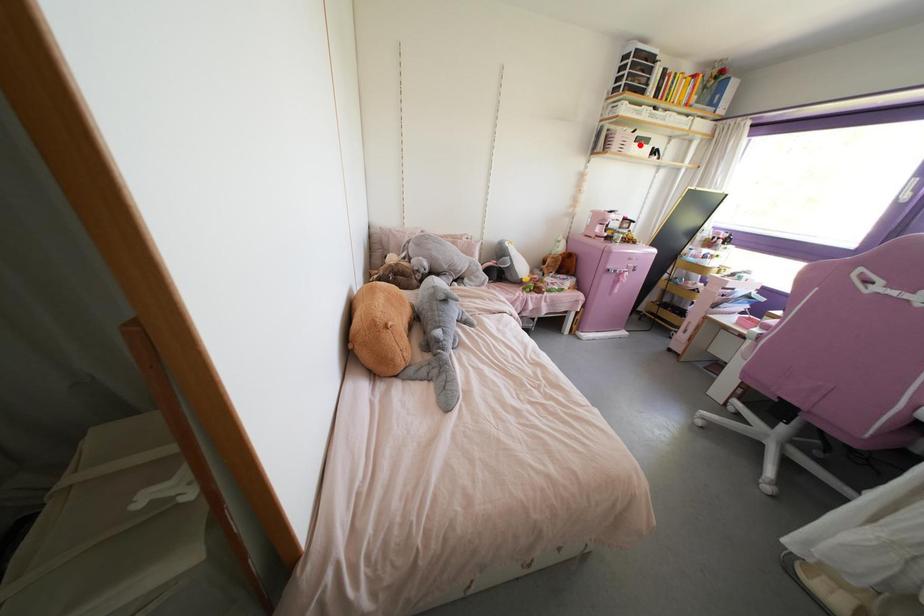
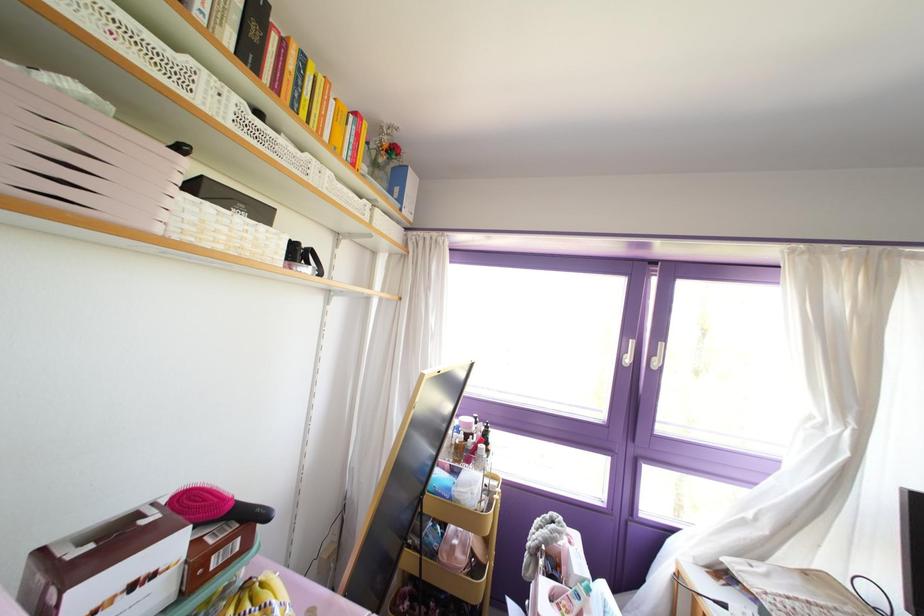
Where in the second image is the point corresponding to the highlighted location from the first image?

(237, 219)